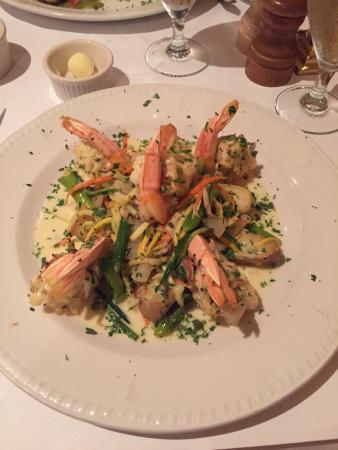
Where is `table cloth`? table cloth is located at coordinates (218, 73).